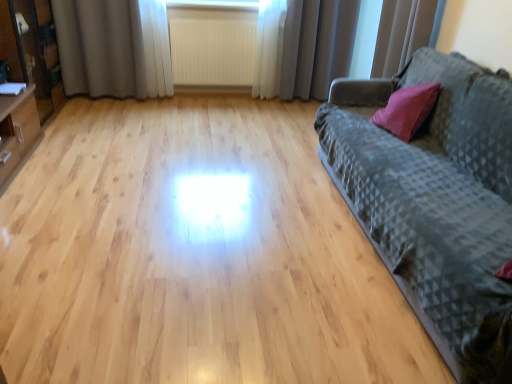
Question: Is white textured radiator at center outside matte black cabinet at left?

Choices:
 (A) no
 (B) yes

Answer: (B)

Question: Can you confirm if white textured radiator at center is taller than matte black cabinet at left?

Choices:
 (A) yes
 (B) no

Answer: (B)

Question: Is white textured radiator at center positioned with its back to matte black cabinet at left?

Choices:
 (A) yes
 (B) no

Answer: (B)

Question: Is white textured radiator at center behind matte black cabinet at left?

Choices:
 (A) yes
 (B) no

Answer: (A)

Question: From the image's perspective, would you say white textured radiator at center is positioned over matte black cabinet at left?

Choices:
 (A) no
 (B) yes

Answer: (B)

Question: Is white textured radiator at center inside the boundaries of dark gray textured fabric couch at right, or outside?

Choices:
 (A) outside
 (B) inside

Answer: (A)

Question: Is white textured radiator at center wider or thinner than dark gray textured fabric couch at right?

Choices:
 (A) wide
 (B) thin

Answer: (B)

Question: Considering the relative positions of white textured radiator at center and dark gray textured fabric couch at right in the image provided, is white textured radiator at center to the left or to the right of dark gray textured fabric couch at right?

Choices:
 (A) left
 (B) right

Answer: (A)

Question: From the image's perspective, is white textured radiator at center located above or below dark gray textured fabric couch at right?

Choices:
 (A) above
 (B) below

Answer: (A)

Question: From a real-world perspective, relative to white textured radiator at center, is matte black cabinet at left vertically above or below?

Choices:
 (A) below
 (B) above

Answer: (B)

Question: From the image's perspective, is matte black cabinet at left above or below white textured radiator at center?

Choices:
 (A) below
 (B) above

Answer: (A)

Question: Considering their positions, is matte black cabinet at left located in front of or behind white textured radiator at center?

Choices:
 (A) behind
 (B) front

Answer: (B)

Question: Is point (6, 16) closer or farther from the camera than point (248, 46)?

Choices:
 (A) farther
 (B) closer

Answer: (B)

Question: Is dark gray textured fabric couch at right inside or outside of gray fabric curtain at upper left, which is counted as the 3th curtain, starting from the right?

Choices:
 (A) outside
 (B) inside

Answer: (A)

Question: In terms of width, does dark gray textured fabric couch at right look wider or thinner when compared to gray fabric curtain at upper left, which is counted as the first curtain, starting from the left?

Choices:
 (A) thin
 (B) wide

Answer: (B)